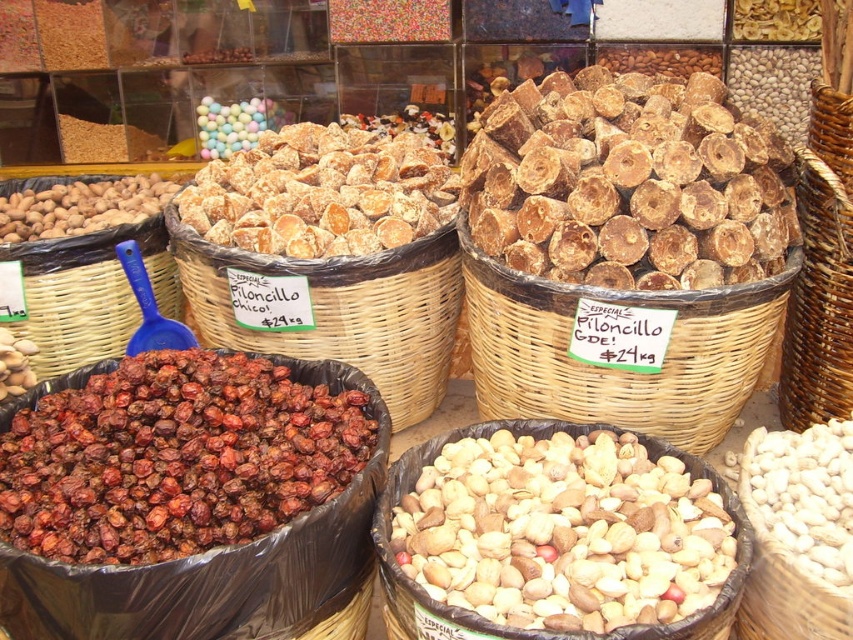
Question: In this image, where is pastel glossy balls at upper center located relative to woven brown basket at upper right?

Choices:
 (A) below
 (B) above

Answer: (B)

Question: Is brown rough wood at upper right in front of woven brown basket at upper right?

Choices:
 (A) yes
 (B) no

Answer: (A)

Question: Is brown rough wood at upper right above brown matte nuts at left?

Choices:
 (A) no
 (B) yes

Answer: (B)

Question: Which of the following is the closest to the observer?

Choices:
 (A) (511, 580)
 (B) (94, 189)
 (C) (746, 449)

Answer: (A)

Question: Which object appears closest to the camera in this image?

Choices:
 (A) brown matte dried fruits at lower left
 (B) sugary brown cookies at center
 (C) brown matte nuts at left

Answer: (A)

Question: Which of the following is the closest to the observer?

Choices:
 (A) brown matte dried fruits at lower left
 (B) brown rough wood at upper right
 (C) brown woven basket at center

Answer: (A)